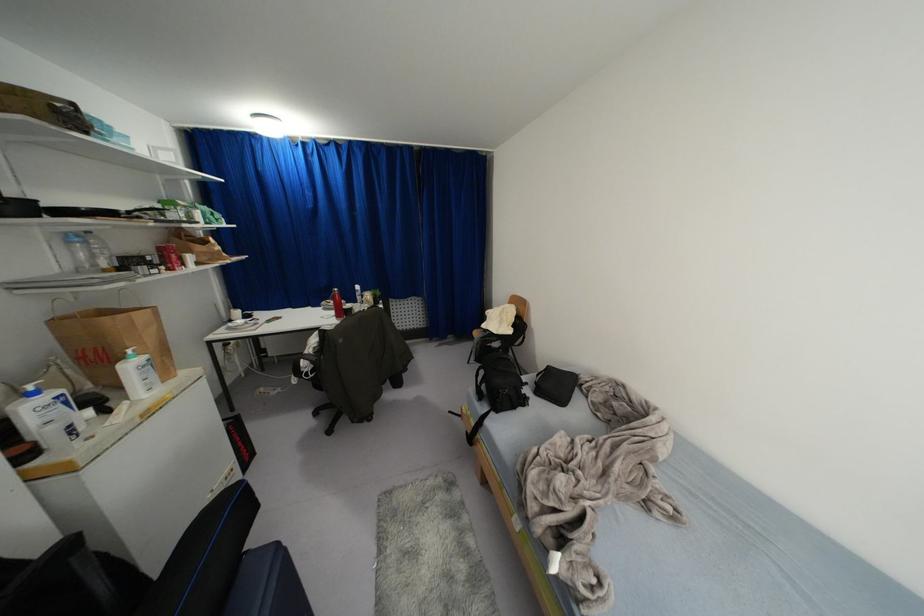
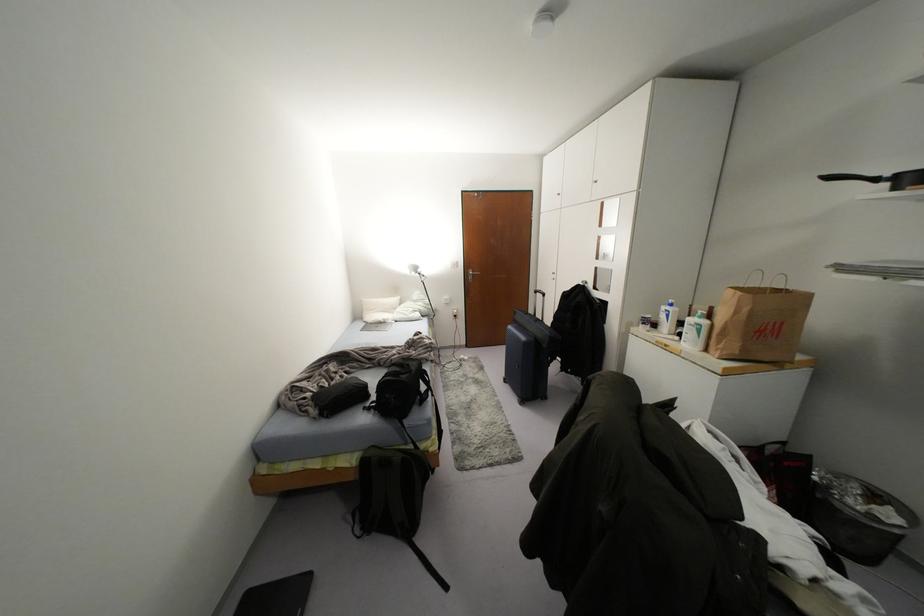
The point at (142,355) is marked in the first image. Where is the corresponding point in the second image?

(703, 322)